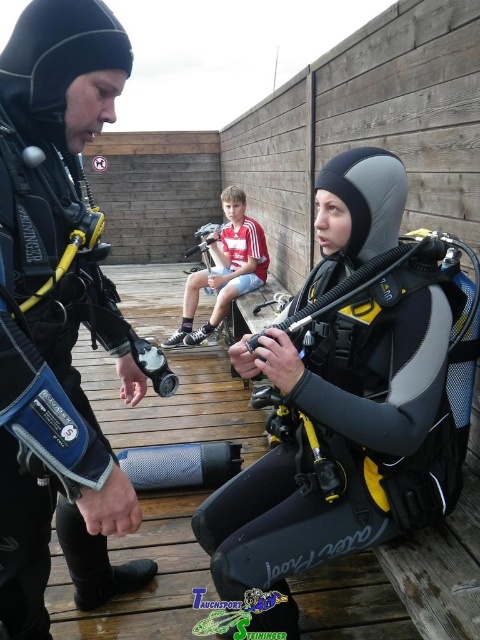
You are a photographer trying to capture both the matte black wetsuit at center and the red striped shirt at center in a single frame. Based on their positions, which one should you adjust your camera angle to focus on first to ensure both are in the frame?

The matte black wetsuit at center is to the right of the red striped shirt at center, so you should focus on the red striped shirt at center first to ensure both are included in the frame.

You are a photographer on a wooden deck where two scuba divers are preparing. You need to take a photo that includes both the matte black wetsuit at center and the matte black wetsuit at left. Based on their positions, which one should be placed lower in the frame to ensure both are fully visible?

The matte black wetsuit at center is below the matte black wetsuit at left, so to include both fully in the photo, the matte black wetsuit at center should be placed lower in the frame.